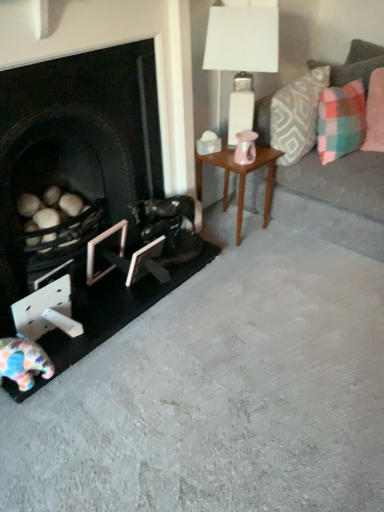
Where is `free space in front of white matte picture frame at lower center, which is counted as the 1th picture frame, starting from the right`? free space in front of white matte picture frame at lower center, which is counted as the 1th picture frame, starting from the right is located at coordinates (132, 306).